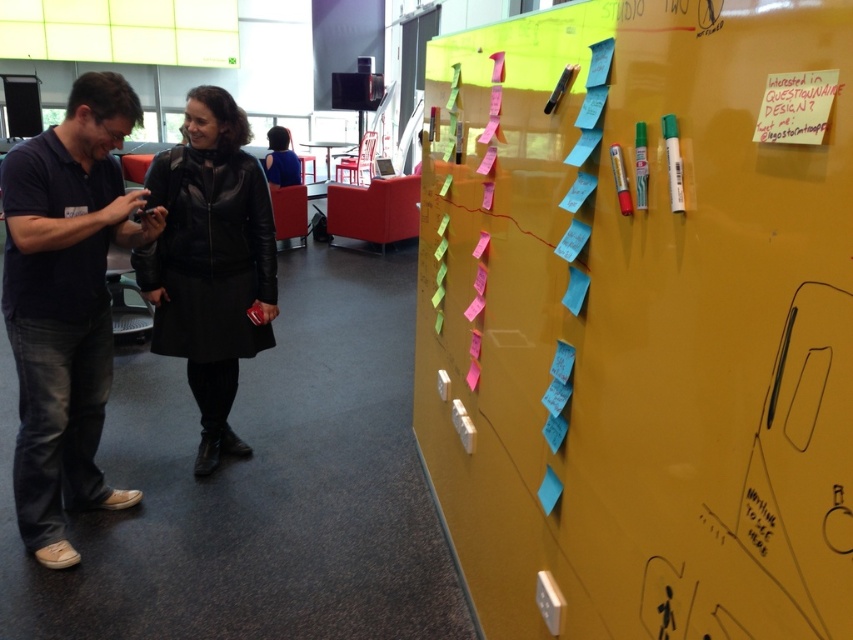
Consider the image. You are standing in the workspace described. You need to hang a large poster that requires 1.2 meters of vertical space. Given the yellow matte bulletin board at upper right and the dark blue cotton shirt at left, which object can accommodate the poster vertically?

The yellow matte bulletin board at upper right has a greater height compared to the dark blue cotton shirt at left, so it can accommodate the large poster vertically as it provides enough vertical space.

You are standing in the workspace and need to locate both the yellow matte bulletin board at upper right and the black leather jacket at center. Which object is positioned to the right of the other?

The yellow matte bulletin board at upper right is to the right of the black leather jacket at center.

You are standing in the workspace and want to hand a document to the person wearing the dark blue cotton shirt at left without getting too close. The minimum safe distance is 6 feet. Can you stay within the safe distance while handing the document?

Yes, because they are 6.40 feet apart, which is just above the 6 feet minimum safe distance, so you can hand the document while maintaining the required distance.